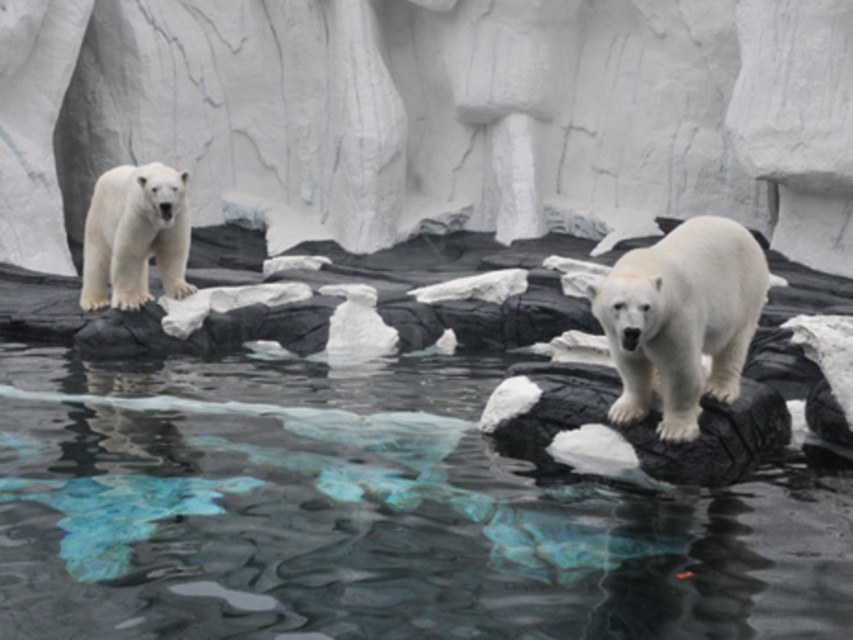
Who is shorter, white ice at upper center or white fur polar bear at center?

With less height is white fur polar bear at center.

Does white ice at upper center have a greater width compared to white fur polar bear at center?

Yes.

Find the location of a particular element. The height and width of the screenshot is (640, 853). white ice at upper center is located at coordinates (433, 115).

Locate an element on the screen. The height and width of the screenshot is (640, 853). white ice at upper center is located at coordinates (433, 115).

Does point (316, 205) come behind point (131, 202)?

Yes, point (316, 205) is behind point (131, 202).

Between white ice at upper center and white fur polar bear at upper left, which one has less height?

Standing shorter between the two is white fur polar bear at upper left.

Who is more distant from viewer, [457,150] or [178,273]?

The point [457,150] is more distant.

Where is `white ice at upper center`? white ice at upper center is located at coordinates (433, 115).

The image size is (853, 640). What are the coordinates of `clear glass water at center` in the screenshot? It's located at (373, 515).

Does point (817, 460) come farther from viewer compared to point (715, 403)?

Yes, point (817, 460) is behind point (715, 403).

What are the coordinates of `clear glass water at center` in the screenshot? It's located at (373, 515).